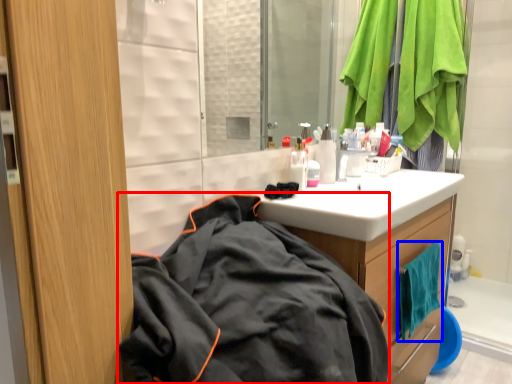
Question: Which object appears closest to the camera in this image, jacket (highlighted by a red box) or beach towel (highlighted by a blue box)?

Choices:
 (A) jacket
 (B) beach towel

Answer: (A)